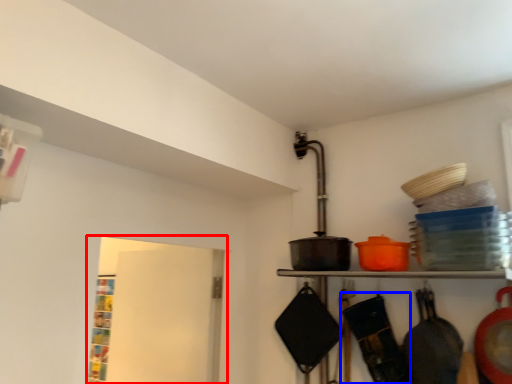
Question: Which of the following is the closest to the observer, window (highlighted by a red box) or frying pan (highlighted by a blue box)?

Choices:
 (A) window
 (B) frying pan

Answer: (B)